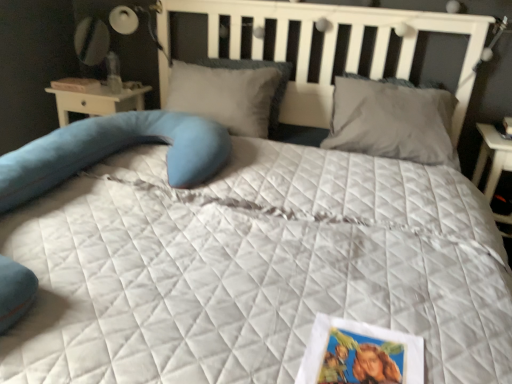
What are the coordinates of `gray matte pillow at upper right, the first pillow positioned from the right` in the screenshot? It's located at (392, 122).

What is the approximate height of gray matte pillow at upper right, the first pillow positioned from the right?

26.24 centimeters.

Describe the element at coordinates (227, 95) in the screenshot. The image size is (512, 384). I see `soft gray pillow at center, the first pillow from the left` at that location.

You are a GUI agent. You are given a task and a screenshot of the screen. Output one action in this format:
    pyautogui.click(x=<x>, y=<y>)
    Task: Click on the soft gray pillow at center, the first pillow from the left
    The image size is (512, 384).
    Given the screenshot: What is the action you would take?
    pyautogui.click(x=227, y=95)

Identify the location of gray matte pillow at upper right, placed as the second pillow when sorted from left to right. (392, 122).

Is soft gray pillow at center, the first pillow from the left, bigger than white paper book at upper left?

Yes.

Is soft gray pillow at center, the first pillow from the left, completely or partially outside of white paper book at upper left?

soft gray pillow at center, the first pillow from the left, is positioned outside white paper book at upper left.

Considering the positions of points (277, 102) and (77, 82), is point (277, 102) farther from camera compared to point (77, 82)?

Yes, point (277, 102) is farther from viewer.

From a real-world perspective, is soft gray pillow at center, the first pillow from the left, located higher than white paper book at upper left?

Yes.

Which of these two, gray matte pillow at upper right, placed as the second pillow when sorted from left to right, or white paper book at upper left, stands taller?

gray matte pillow at upper right, placed as the second pillow when sorted from left to right.

From the image's perspective, is gray matte pillow at upper right, placed as the second pillow when sorted from left to right, located above or below white paper book at upper left?

Clearly, from the image's perspective, gray matte pillow at upper right, placed as the second pillow when sorted from left to right, is below white paper book at upper left.

Looking at this image, considering the relative sizes of gray matte pillow at upper right, the first pillow positioned from the right, and white paper book at upper left in the image provided, is gray matte pillow at upper right, the first pillow positioned from the right, bigger than white paper book at upper left?

Yes.

Are gray matte pillow at upper right, the first pillow positioned from the right, and white paper book at upper left located far from each other?

Yes, gray matte pillow at upper right, the first pillow positioned from the right, and white paper book at upper left are located far from each other.

Is white paper book at upper left surrounding gray matte pillow at upper right, the first pillow positioned from the right?

No, gray matte pillow at upper right, the first pillow positioned from the right, is not inside white paper book at upper left.

Identify the location of book behind the gray matte pillow at upper right, the first pillow positioned from the right. This screenshot has height=384, width=512. (76, 84).

Between white paper book at upper left and gray matte pillow at upper right, the first pillow positioned from the right, which one has larger size?

gray matte pillow at upper right, the first pillow positioned from the right, is bigger.

Does white paper book at upper left have a lesser width compared to gray matte pillow at upper right, the first pillow positioned from the right?

Correct, the width of white paper book at upper left is less than that of gray matte pillow at upper right, the first pillow positioned from the right.

Does soft gray pillow at center, placed as the 2th pillow when sorted from right to left, have a greater height compared to printed paper postcard at lower right?

Indeed, soft gray pillow at center, placed as the 2th pillow when sorted from right to left, has a greater height compared to printed paper postcard at lower right.

Which is behind, point (256, 71) or point (368, 371)?

The point (256, 71) is more distant.

Considering the relative sizes of soft gray pillow at center, the first pillow from the left, and printed paper postcard at lower right in the image provided, is soft gray pillow at center, the first pillow from the left, wider than printed paper postcard at lower right?

Yes, soft gray pillow at center, the first pillow from the left, is wider than printed paper postcard at lower right.

In order to click on postcard that is in front of the soft gray pillow at center, the first pillow from the left in this screenshot , I will do `click(360, 354)`.

Based on the photo, is printed paper postcard at lower right closer to camera compared to soft gray pillow at center, placed as the 2th pillow when sorted from right to left?

Yes, printed paper postcard at lower right is in front of soft gray pillow at center, placed as the 2th pillow when sorted from right to left.

Is printed paper postcard at lower right positioned beyond the bounds of soft gray pillow at center, placed as the 2th pillow when sorted from right to left?

Yes.

Is printed paper postcard at lower right facing away from soft gray pillow at center, placed as the 2th pillow when sorted from right to left?

No, printed paper postcard at lower right is not facing away from soft gray pillow at center, placed as the 2th pillow when sorted from right to left.

From the image's perspective, does gray matte pillow at upper right, placed as the second pillow when sorted from left to right, appear higher than soft gray pillow at center, the first pillow from the left?

No, from the image's perspective, gray matte pillow at upper right, placed as the second pillow when sorted from left to right, is not above soft gray pillow at center, the first pillow from the left.

Is gray matte pillow at upper right, placed as the second pillow when sorted from left to right, smaller than soft gray pillow at center, the first pillow from the left?

Correct, gray matte pillow at upper right, placed as the second pillow when sorted from left to right, occupies less space than soft gray pillow at center, the first pillow from the left.

Which is more to the left, gray matte pillow at upper right, placed as the second pillow when sorted from left to right, or soft gray pillow at center, the first pillow from the left?

From the viewer's perspective, soft gray pillow at center, the first pillow from the left, appears more on the left side.

Based on their sizes in the image, would you say printed paper postcard at lower right is bigger or smaller than gray matte pillow at upper right, placed as the second pillow when sorted from left to right?

In the image, printed paper postcard at lower right appears to be smaller than gray matte pillow at upper right, placed as the second pillow when sorted from left to right.

From the image's perspective, is printed paper postcard at lower right above or below gray matte pillow at upper right, the first pillow positioned from the right?

Clearly, from the image's perspective, printed paper postcard at lower right is below gray matte pillow at upper right, the first pillow positioned from the right.

Is printed paper postcard at lower right oriented towards gray matte pillow at upper right, placed as the second pillow when sorted from left to right?

No, printed paper postcard at lower right does not turn towards gray matte pillow at upper right, placed as the second pillow when sorted from left to right.

The height and width of the screenshot is (384, 512). In the image, there is a soft gray pillow at center, the first pillow from the left. What are the coordinates of `book above it (from the image's perspective)` in the screenshot? It's located at (76, 84).

You are a GUI agent. You are given a task and a screenshot of the screen. Output one action in this format:
    pyautogui.click(x=<x>, y=<y>)
    Task: Click on the pillow that is the 2nd object to the right of the white paper book at upper left, starting at the anchor
    The height and width of the screenshot is (384, 512).
    Given the screenshot: What is the action you would take?
    pyautogui.click(x=392, y=122)

Looking at the image, which one is located closer to soft gray pillow at center, placed as the 2th pillow when sorted from right to left, white paper book at upper left or gray matte pillow at upper right, placed as the second pillow when sorted from left to right?

gray matte pillow at upper right, placed as the second pillow when sorted from left to right, lies closer to soft gray pillow at center, placed as the 2th pillow when sorted from right to left, than the other object.

Consider the image. Estimate the real-world distances between objects in this image. Which object is closer to printed paper postcard at lower right, white paper book at upper left or gray matte pillow at upper right, placed as the second pillow when sorted from left to right?

gray matte pillow at upper right, placed as the second pillow when sorted from left to right, lies closer to printed paper postcard at lower right than the other object.

From the image, which object appears to be nearer to white paper book at upper left, soft gray pillow at center, the first pillow from the left, or printed paper postcard at lower right?

soft gray pillow at center, the first pillow from the left, lies closer to white paper book at upper left than the other object.

Which object lies nearer to the anchor point soft gray pillow at center, the first pillow from the left, white paper book at upper left or printed paper postcard at lower right?

white paper book at upper left is closer to soft gray pillow at center, the first pillow from the left.

Based on their spatial positions, is gray matte pillow at upper right, placed as the second pillow when sorted from left to right, or printed paper postcard at lower right closer to white paper book at upper left?

Based on the image, gray matte pillow at upper right, placed as the second pillow when sorted from left to right, appears to be nearer to white paper book at upper left.

Consider the image. Looking at the image, which one is located closer to gray matte pillow at upper right, the first pillow positioned from the right, soft gray pillow at center, placed as the 2th pillow when sorted from right to left, or printed paper postcard at lower right?

Among the two, soft gray pillow at center, placed as the 2th pillow when sorted from right to left, is located nearer to gray matte pillow at upper right, the first pillow positioned from the right.

Looking at the image, which one is located closer to gray matte pillow at upper right, the first pillow positioned from the right, printed paper postcard at lower right or soft gray pillow at center, placed as the 2th pillow when sorted from right to left?

The object closer to gray matte pillow at upper right, the first pillow positioned from the right, is soft gray pillow at center, placed as the 2th pillow when sorted from right to left.

Which object lies nearer to the anchor point white paper book at upper left, printed paper postcard at lower right or soft gray pillow at center, placed as the 2th pillow when sorted from right to left?

Based on the image, soft gray pillow at center, placed as the 2th pillow when sorted from right to left, appears to be nearer to white paper book at upper left.

I want to click on pillow located between white paper book at upper left and gray matte pillow at upper right, placed as the second pillow when sorted from left to right, in the left-right direction, so click(227, 95).

The height and width of the screenshot is (384, 512). Identify the location of pillow between printed paper postcard at lower right and soft gray pillow at center, the first pillow from the left, along the z-axis. (392, 122).